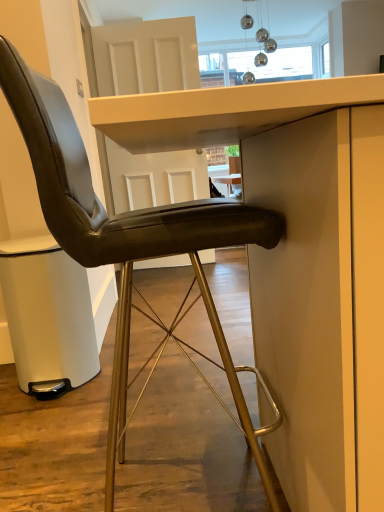
Question: From their relative heights in the image, would you say black leather chair at center is taller or shorter than matte white table at center?

Choices:
 (A) tall
 (B) short

Answer: (A)

Question: Is black leather chair at center wider or thinner than matte white table at center?

Choices:
 (A) wide
 (B) thin

Answer: (B)

Question: Considering the positions of black leather chair at center and matte white table at center in the image, is black leather chair at center bigger or smaller than matte white table at center?

Choices:
 (A) big
 (B) small

Answer: (B)

Question: In terms of size, does matte white table at center appear bigger or smaller than black leather chair at center?

Choices:
 (A) small
 (B) big

Answer: (B)

Question: Is matte white table at center to the left or to the right of black leather chair at center in the image?

Choices:
 (A) right
 (B) left

Answer: (A)

Question: Is matte white table at center wider or thinner than black leather chair at center?

Choices:
 (A) wide
 (B) thin

Answer: (A)

Question: Is matte white table at center inside or outside of black leather chair at center?

Choices:
 (A) outside
 (B) inside

Answer: (A)